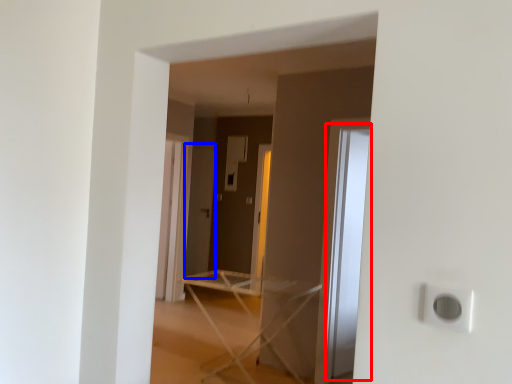
Question: Which point is closer to the camera, glass door (highlighted by a red box) or screen door (highlighted by a blue box)?

Choices:
 (A) glass door
 (B) screen door

Answer: (A)